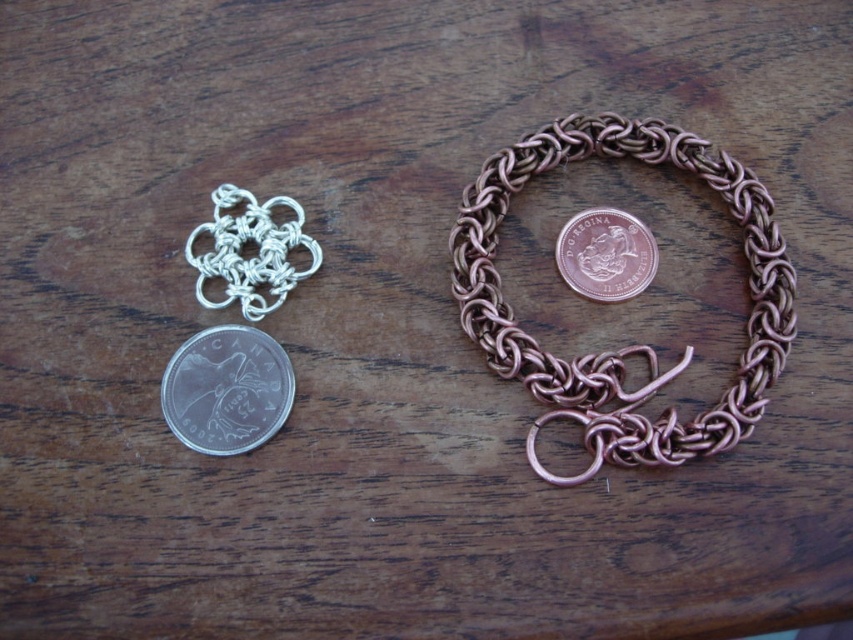
This screenshot has width=853, height=640. Describe the element at coordinates (630, 346) in the screenshot. I see `copper wire bracelet at center` at that location.

Does copper wire bracelet at center have a lesser height compared to silver/metallic chain at center?

No.

Where is `copper wire bracelet at center`? The height and width of the screenshot is (640, 853). copper wire bracelet at center is located at coordinates (630, 346).

Find the location of a particular element. Image resolution: width=853 pixels, height=640 pixels. copper wire bracelet at center is located at coordinates (630, 346).

Does silver metallic coin at lower left have a lesser height compared to silver/metallic chain at center?

Yes, silver metallic coin at lower left is shorter than silver/metallic chain at center.

Between silver metallic coin at lower left and silver/metallic chain at center, which one is positioned lower?

silver metallic coin at lower left is below.

Which is in front, point (221, 428) or point (262, 259)?

Point (221, 428) is in front.

Locate an element on the screen. silver metallic coin at lower left is located at coordinates (225, 388).

Does silver metallic coin at lower left come behind rose gold metallic coin at center?

No, silver metallic coin at lower left is closer to the viewer.

Is point (219, 426) closer to viewer compared to point (555, 241)?

Yes, point (219, 426) is in front of point (555, 241).

Is point (259, 410) farther from viewer compared to point (575, 284)?

That is False.

This screenshot has width=853, height=640. What are the coordinates of `silver metallic coin at lower left` in the screenshot? It's located at (225, 388).